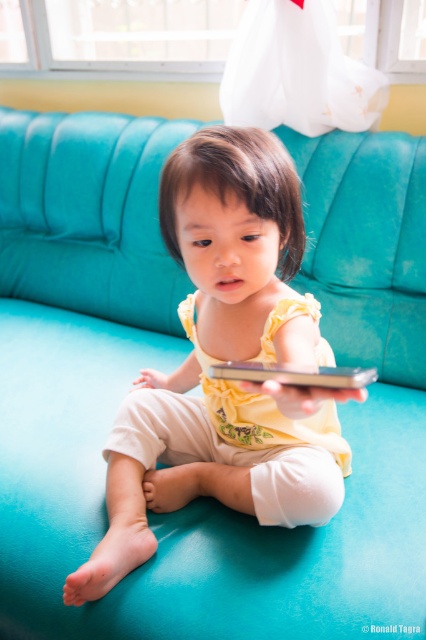
You are a photographer setting up a shoot in this room. You want to capture a shot where the yellow fabric child at center is positioned above the silver metallic tablet at center. Is this possible based on their current arrangement?

The yellow fabric child at center is currently below the silver metallic tablet at center, so to position the child above the tablet, you would need to adjust their placement since they are not naturally in that position.

In the scene shown: You are a photographer trying to capture a closeup shot of the silver metallic tablet at center. To frame the shot properly, you need to know the position of the yellow fabric child at center relative to the tablet. Can you tell me which side of the tablet the child is on?

The yellow fabric child at center is positioned on the left side of the silver metallic tablet at center, so the child is to the left of the tablet.

You are a photographer trying to capture a candid shot of the child without them noticing. You have two points marked in the scene where you can position your camera. The first point is at coordinates point [152,545], and the second is at point [287,380]. Which point would allow you to hide the camera behind an object so the child doesn not see it?

Point [152,545] is behind point [287,380], so positioning the camera at point [152,545] would allow you to hide it behind the object located at point [287,380], making it less visible to the child.